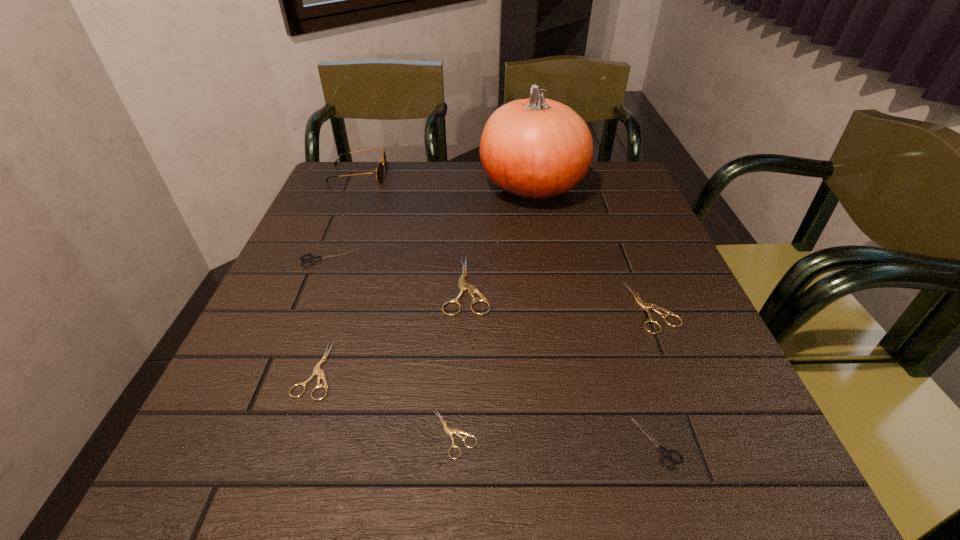
In the image, there is a desktop. Identify the location of vacant space at the near edge. This screenshot has width=960, height=540. pos(457,461).

Find the location of `vacant area at the left edge of the desktop`. vacant area at the left edge of the desktop is located at coordinates (290, 408).

This screenshot has width=960, height=540. I want to click on vacant space at the right edge of the desktop, so click(697, 361).

Locate an element on the screen. Image resolution: width=960 pixels, height=540 pixels. vacant region at the far left corner of the desktop is located at coordinates 326,191.

In the image, there is a desktop. What are the coordinates of `vacant region at the far right corner` in the screenshot? It's located at (606, 163).

Where is `vacant space at the near right corner of the desktop`? vacant space at the near right corner of the desktop is located at coordinates (756, 460).

This screenshot has width=960, height=540. In order to click on vacant space that's between the biggest beige shears and the second biggest beige shears in this screenshot , I will do `click(559, 296)`.

You are a GUI agent. You are given a task and a screenshot of the screen. Output one action in this format:
    pyautogui.click(x=<x>, y=<y>)
    Task: Click on the vacant point located between the rightmost beige shears and the sunglasses
    
    Given the screenshot: What is the action you would take?
    pyautogui.click(x=505, y=240)

Identify the location of free space between the biggest beige shears and the black sunglasses. Image resolution: width=960 pixels, height=540 pixels. (413, 230).

Locate an element on the screen. blank region between the biggest beige shears and the seventh shortest object is located at coordinates click(413, 230).